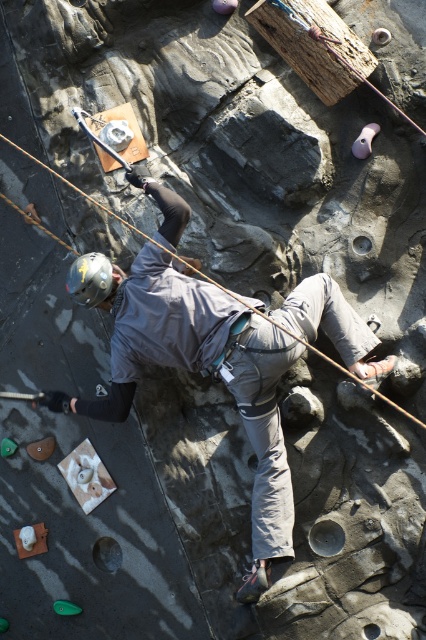
Question: Which point is farther to the camera?

Choices:
 (A) (206, 371)
 (B) (75, 298)

Answer: (A)

Question: Is gray fabric jacket at center above matte gray helmet at center?

Choices:
 (A) yes
 (B) no

Answer: (B)

Question: Which point is farther from the camera taking this photo?

Choices:
 (A) (249, 397)
 (B) (78, 266)

Answer: (A)

Question: Which point is closer to the camera?

Choices:
 (A) matte gray helmet at center
 (B) gray fabric jacket at center

Answer: (B)

Question: In this image, where is gray fabric jacket at center located relative to matte gray helmet at center?

Choices:
 (A) below
 (B) above

Answer: (A)

Question: Does gray fabric jacket at center have a greater width compared to matte gray helmet at center?

Choices:
 (A) yes
 (B) no

Answer: (A)